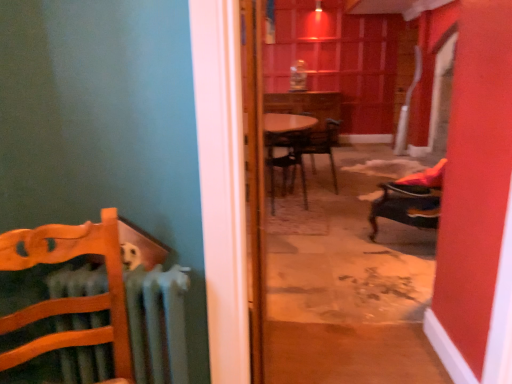
You are a GUI agent. You are given a task and a screenshot of the screen. Output one action in this format:
    pyautogui.click(x=<x>, y=<y>)
    Task: Click on the vacant space underneath velvet orange chair at right, which is counted as the second chair, starting from the front (from a real-world perspective)
    The width and height of the screenshot is (512, 384).
    Given the screenshot: What is the action you would take?
    pyautogui.click(x=402, y=239)